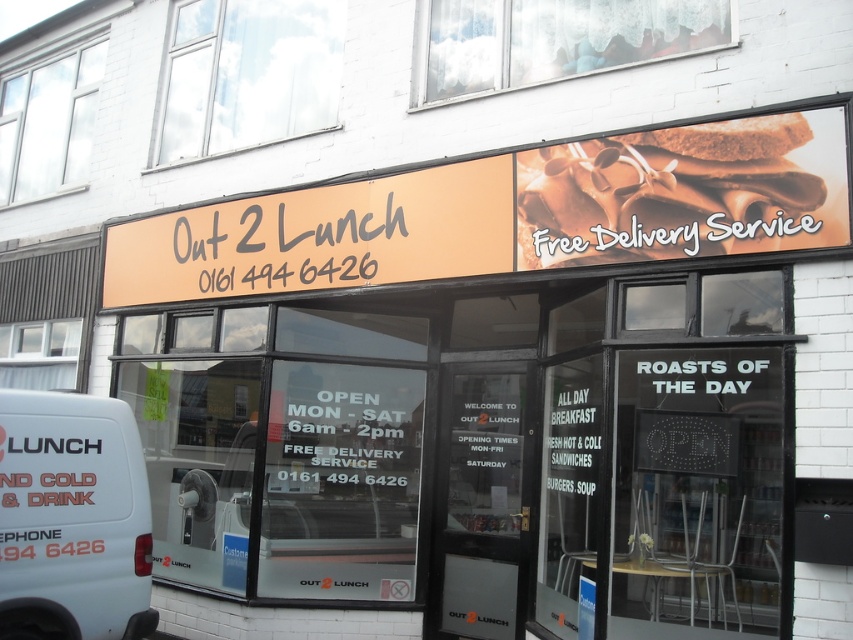
You are standing in front of the restaurant and want to know how far you are from the point marked at coordinates point (531, 212). Can you determine the distance?

The distance between you and the point marked at coordinates point (531, 212) is 17.30 feet.

You are standing in front of the restaurant and notice two points marked on the glass display. The first point is at position (805, 214) and the second at (107, 429). Which point appears closer to you?

Point (805, 214) is closer to the camera than point (107, 429), so the first point appears closer to you.

You are a customer standing in front of the restaurant. You see the chocolate matte sandwich at upper right and the white matte van at lower left. Which object is higher up in the image?

The chocolate matte sandwich at upper right is located above the white matte van at lower left, so it is higher up in the image.